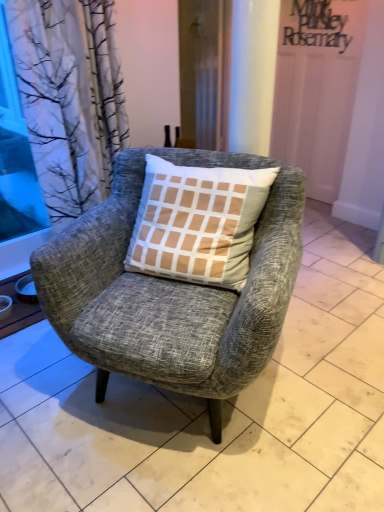
Describe the element at coordinates (171, 290) in the screenshot. I see `textured gray armchair at center` at that location.

The width and height of the screenshot is (384, 512). In order to click on transparent glass window screen at left in this screenshot , I will do tap(16, 155).

Describe the element at coordinates (18, 309) in the screenshot. I see `matte wood window sill at lower left` at that location.

Locate an element on the screen. The height and width of the screenshot is (512, 384). textured gray armchair at center is located at coordinates (171, 290).

Is point (12, 196) farther from camera compared to point (241, 368)?

Yes.

Is transparent glass window screen at left with textured gray armchair at center?

transparent glass window screen at left is not next to textured gray armchair at center, and they're not touching.

From a real-world perspective, which is physically below, transparent glass window screen at left or textured gray armchair at center?

textured gray armchair at center, from a real-world perspective.

Can you tell me how much transparent glass window screen at left and textured gray armchair at center differ in facing direction?

67.6 degrees.

Does matte wood window sill at lower left lie in front of textured gray armchair at center?

No, the depth of matte wood window sill at lower left is greater than that of textured gray armchair at center.

In the scene shown: Which of these two, matte wood window sill at lower left or textured gray armchair at center, is wider?

With larger width is textured gray armchair at center.

This screenshot has width=384, height=512. In order to click on window sill below the textured gray armchair at center (from the image's perspective) in this screenshot , I will do `click(18, 309)`.

Can you tell me how much matte wood window sill at lower left and textured gray armchair at center differ in facing direction?

The angle between the facing direction of matte wood window sill at lower left and the facing direction of textured gray armchair at center is 21.6 degrees.

Which is more to the right, textured gray armchair at center or transparent glass window screen at left?

textured gray armchair at center is more to the right.

How many degrees apart are the facing directions of textured gray armchair at center and transparent glass window screen at left?

67.6 degrees.

Based on the photo, which object is thinner, textured gray armchair at center or transparent glass window screen at left?

With smaller width is transparent glass window screen at left.

Would you consider textured gray armchair at center to be distant from transparent glass window screen at left?

Yes, textured gray armchair at center is far from transparent glass window screen at left.

Can you confirm if textured gray armchair at center is positioned to the left of matte wood window sill at lower left?

In fact, textured gray armchair at center is to the right of matte wood window sill at lower left.

Is textured gray armchair at center facing away from matte wood window sill at lower left?

textured gray armchair at center does not have its back to matte wood window sill at lower left.

Does point (93, 308) appear closer or farther from the camera than point (18, 278)?

Clearly, point (93, 308) is closer to the camera than point (18, 278).

From a real-world perspective, is textured gray armchair at center physically located above or below matte wood window sill at lower left?

From a real-world perspective, textured gray armchair at center is physically above matte wood window sill at lower left.

Is matte wood window sill at lower left facing towards transparent glass window screen at left?

No.

Can you confirm if matte wood window sill at lower left is positioned to the left of transparent glass window screen at left?

No, matte wood window sill at lower left is not to the left of transparent glass window screen at left.

In the scene shown: Does matte wood window sill at lower left have a greater height compared to transparent glass window screen at left?

Incorrect, the height of matte wood window sill at lower left is not larger of that of transparent glass window screen at left.

What's the angular difference between matte wood window sill at lower left and transparent glass window screen at left's facing directions?

89.2 degrees separate the facing orientations of matte wood window sill at lower left and transparent glass window screen at left.

Is transparent glass window screen at left taller than wooden screen door at center?

Correct, transparent glass window screen at left is much taller as wooden screen door at center.

From a real-world perspective, is transparent glass window screen at left positioned above or below wooden screen door at center?

Clearly, from a real-world perspective, transparent glass window screen at left is below wooden screen door at center.

Which of these two, transparent glass window screen at left or wooden screen door at center, is bigger?

With larger size is wooden screen door at center.

Is transparent glass window screen at left in front of wooden screen door at center?

Yes, the depth of transparent glass window screen at left is less than that of wooden screen door at center.

Considering the relative sizes of transparent glass window screen at left and matte wood window sill at lower left in the image provided, is transparent glass window screen at left wider than matte wood window sill at lower left?

Incorrect, the width of transparent glass window screen at left does not surpass that of matte wood window sill at lower left.

From the image's perspective, which is above, transparent glass window screen at left or matte wood window sill at lower left?

transparent glass window screen at left, from the image's perspective.

How different are the orientations of transparent glass window screen at left and matte wood window sill at lower left in degrees?

The angular difference between transparent glass window screen at left and matte wood window sill at lower left is 89.2 degrees.

Between transparent glass window screen at left and matte wood window sill at lower left, which one has larger size?

transparent glass window screen at left.

At what (x,y) coordinates should I click in order to perform the action: click on chair that appears on the right of transparent glass window screen at left. Please return your answer as a coordinate pair (x, y). Looking at the image, I should click on (171, 290).

I want to click on window sill behind the textured gray armchair at center, so click(18, 309).

Looking at the image, which one is located closer to textured gray armchair at center, wooden screen door at center or transparent glass window screen at left?

wooden screen door at center.

Based on their spatial positions, is textured gray armchair at center or wooden screen door at center closer to transparent glass window screen at left?

wooden screen door at center.

When comparing their distances from matte wood window sill at lower left, does textured gray armchair at center or wooden screen door at center seem further?

wooden screen door at center is positioned further to the anchor matte wood window sill at lower left.

From the image, which object appears to be farther from matte wood window sill at lower left, transparent glass window screen at left or wooden screen door at center?

wooden screen door at center.

Based on the photo, considering their positions, is wooden screen door at center positioned further to textured gray armchair at center than matte wood window sill at lower left?

wooden screen door at center lies further to textured gray armchair at center than the other object.

Based on their spatial positions, is transparent glass window screen at left or textured gray armchair at center further from wooden screen door at center?

transparent glass window screen at left.

In the scene shown: From the image, which object appears to be farther from transparent glass window screen at left, matte wood window sill at lower left or wooden screen door at center?

wooden screen door at center is positioned further to the anchor transparent glass window screen at left.

Looking at the image, which one is located closer to textured gray armchair at center, transparent glass window screen at left or wooden screen door at center?

wooden screen door at center is positioned closer to the anchor textured gray armchair at center.

The height and width of the screenshot is (512, 384). What are the coordinates of `window screen located between textured gray armchair at center and matte wood window sill at lower left in the depth direction` in the screenshot? It's located at (16, 155).

At what (x,y) coordinates should I click in order to perform the action: click on window screen between wooden screen door at center and matte wood window sill at lower left in the up-down direction. Please return your answer as a coordinate pair (x, y). Looking at the image, I should click on (16, 155).

In order to click on window sill between textured gray armchair at center and wooden screen door at center from front to back in this screenshot , I will do `click(18, 309)`.

You are a GUI agent. You are given a task and a screenshot of the screen. Output one action in this format:
    pyautogui.click(x=<x>, y=<y>)
    Task: Click on the window screen between textured gray armchair at center and wooden screen door at center from front to back
    The image size is (384, 512).
    Given the screenshot: What is the action you would take?
    pyautogui.click(x=16, y=155)